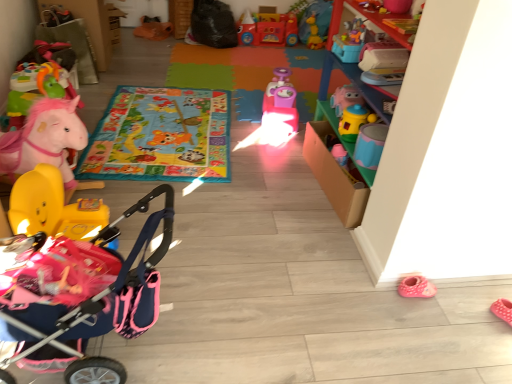
The height and width of the screenshot is (384, 512). In order to click on matte yellow toy at center, the 3th toy in the front-to-back sequence in this screenshot , I will do `click(354, 122)`.

Find the location of a particular element. This screenshot has height=384, width=512. pink plush horse at left, the 5th toy in the front-to-back sequence is located at coordinates [35, 89].

Find the location of `pink fabric baby carriage at lower left`. pink fabric baby carriage at lower left is located at coordinates (82, 291).

What do you see at coordinates (314, 34) in the screenshot?
I see `rubber duck at upper center, arranged as the 9th toy when viewed from the front` at bounding box center [314, 34].

Identify the location of multicolored foam mat at center, which is counted as the 1th mat, starting from the back. The image size is (512, 384). (247, 74).

From the image's perspective, which object appears higher, pink fabric baby carriage at lower left or multicolored foam mat at center, arranged as the 2th mat when viewed from the front?

multicolored foam mat at center, arranged as the 2th mat when viewed from the front, is shown above in the image.

Could you tell me if pink fabric baby carriage at lower left is facing multicolored foam mat at center, arranged as the 2th mat when viewed from the front?

No, pink fabric baby carriage at lower left is not facing towards multicolored foam mat at center, arranged as the 2th mat when viewed from the front.

Is point (135, 316) positioned after point (303, 95)?

No, it is in front of (303, 95).

From a real-world perspective, relative to orange fabric bag at upper center, marked as the 7th toy in a front-to-back arrangement, is pink plush horse at left, which appears as the 5th toy when viewed from the back, vertically above or below?

In terms of real-world spatial position, pink plush horse at left, which appears as the 5th toy when viewed from the back, is above orange fabric bag at upper center, marked as the 7th toy in a front-to-back arrangement.

Is pink plush horse at left, the 5th toy in the front-to-back sequence, not inside orange fabric bag at upper center, marked as the 7th toy in a front-to-back arrangement?

Yes, pink plush horse at left, the 5th toy in the front-to-back sequence, is not within orange fabric bag at upper center, marked as the 7th toy in a front-to-back arrangement.

In the image, is pink plush horse at left, which appears as the 5th toy when viewed from the back, positioned in front of or behind orange fabric bag at upper center, marked as the 7th toy in a front-to-back arrangement?

pink plush horse at left, which appears as the 5th toy when viewed from the back, is positioned closer to the viewer than orange fabric bag at upper center, marked as the 7th toy in a front-to-back arrangement.

How many degrees apart are the facing directions of pink plush horse at left, the 5th toy in the front-to-back sequence, and orange fabric bag at upper center, marked as the 7th toy in a front-to-back arrangement?

The angular difference between pink plush horse at left, the 5th toy in the front-to-back sequence, and orange fabric bag at upper center, marked as the 7th toy in a front-to-back arrangement, is 90 degrees.

From the image's perspective, is multicolored foam mat at center, arranged as the 2th mat when viewed from the front, positioned above or below rubberized plastic toy car at upper center, arranged as the 8th toy when viewed from the front?

Clearly, from the image's perspective, multicolored foam mat at center, arranged as the 2th mat when viewed from the front, is below rubberized plastic toy car at upper center, arranged as the 8th toy when viewed from the front.

Measure the distance between multicolored foam mat at center, which is counted as the 1th mat, starting from the back, and rubberized plastic toy car at upper center, arranged as the 8th toy when viewed from the front.

multicolored foam mat at center, which is counted as the 1th mat, starting from the back, is 23.49 inches from rubberized plastic toy car at upper center, arranged as the 8th toy when viewed from the front.

Considering the relative sizes of multicolored foam mat at center, arranged as the 2th mat when viewed from the front, and rubberized plastic toy car at upper center, arranged as the 8th toy when viewed from the front, in the image provided, is multicolored foam mat at center, arranged as the 2th mat when viewed from the front, taller than rubberized plastic toy car at upper center, arranged as the 8th toy when viewed from the front,?

In fact, multicolored foam mat at center, arranged as the 2th mat when viewed from the front, may be shorter than rubberized plastic toy car at upper center, arranged as the 8th toy when viewed from the front.

Considering the points (221, 74) and (252, 30), which point is in front, point (221, 74) or point (252, 30)?

The point (221, 74) is more forward.

From the image's perspective, would you say multicolored foam mat at center, arranged as the 2th mat when viewed from the front, is shown under pink fabric baby carriage at lower left?

No.

Which is more to the right, multicolored foam mat at center, which is counted as the 1th mat, starting from the back, or pink fabric baby carriage at lower left?

multicolored foam mat at center, which is counted as the 1th mat, starting from the back.

Is multicolored foam mat at center, which is counted as the 1th mat, starting from the back, oriented away from pink fabric baby carriage at lower left?

No.

From a real-world perspective, is multicolored foam mat at center, which is counted as the 1th mat, starting from the back, above or below pink fabric baby carriage at lower left?

multicolored foam mat at center, which is counted as the 1th mat, starting from the back, is below pink fabric baby carriage at lower left.

Is rubberized plastic toy car at upper center, arranged as the 8th toy when viewed from the front, not close to rubber duck at upper center, acting as the first toy starting from the back?

No.

Between rubberized plastic toy car at upper center, arranged as the 8th toy when viewed from the front, and rubber duck at upper center, acting as the first toy starting from the back, which one has more height?

rubberized plastic toy car at upper center, arranged as the 8th toy when viewed from the front.

Considering the sizes of rubberized plastic toy car at upper center, arranged as the 8th toy when viewed from the front, and rubber duck at upper center, acting as the first toy starting from the back, in the image, is rubberized plastic toy car at upper center, arranged as the 8th toy when viewed from the front, bigger or smaller than rubber duck at upper center, acting as the first toy starting from the back,?

rubberized plastic toy car at upper center, arranged as the 8th toy when viewed from the front, is bigger than rubber duck at upper center, acting as the first toy starting from the back.

Is point (282, 23) positioned in front of point (10, 123)?

That is False.

Is pink plush horse at left, which appears as the 5th toy when viewed from the back, at the back of rubberized plastic toy car at upper center, the second toy viewed from the back?

No, rubberized plastic toy car at upper center, the second toy viewed from the back, is not facing the opposite direction of pink plush horse at left, which appears as the 5th toy when viewed from the back.

Which object is thinner, rubberized plastic toy car at upper center, arranged as the 8th toy when viewed from the front, or pink plush horse at left, which appears as the 5th toy when viewed from the back?

rubberized plastic toy car at upper center, arranged as the 8th toy when viewed from the front, is thinner.

In terms of height, does rubberized plastic toy car at upper center, the second toy viewed from the back, look taller or shorter compared to pink plush horse at left, the 5th toy in the front-to-back sequence?

rubberized plastic toy car at upper center, the second toy viewed from the back, is shorter than pink plush horse at left, the 5th toy in the front-to-back sequence.

Is point (346, 92) less distant than point (99, 261)?

That is False.

Is matte plastic toy at upper right, the 6th toy when ordered from back to front, not close to pink fabric baby carriage at lower left?

matte plastic toy at upper right, the 6th toy when ordered from back to front, is positioned a significant distance from pink fabric baby carriage at lower left.

Consider the image. Does matte plastic toy at upper right, the 6th toy when ordered from back to front, turn towards pink fabric baby carriage at lower left?

No, matte plastic toy at upper right, the 6th toy when ordered from back to front, is not oriented towards pink fabric baby carriage at lower left.

The width and height of the screenshot is (512, 384). Identify the location of baby carriage above the multicolored foam mat at center, arranged as the 2th mat when viewed from the front (from a real-world perspective). (82, 291).

Locate an element on the screen. This screenshot has height=384, width=512. toy that is the 3rd object located below the orange fabric bag at upper center, marked as the 7th toy in a front-to-back arrangement (from the image's perspective) is located at coordinates (35, 89).

Consider the image. From the image, which object appears to be nearer to multicolored foam mat at center, which is counted as the 1th mat, starting from the back, vibrant fabric playmat at center, arranged as the 1th mat when viewed from the front, or rubberized plastic toy car at upper center, the second toy viewed from the back?

The object closer to multicolored foam mat at center, which is counted as the 1th mat, starting from the back, is rubberized plastic toy car at upper center, the second toy viewed from the back.

Based on their spatial positions, is pink fabric baby carriage at lower left or matte pink plush horse at left, which is counted as the 8th toy, starting from the back, closer to vibrant fabric playmat at center, arranged as the 1th mat when viewed from the front?

Among the two, matte pink plush horse at left, which is counted as the 8th toy, starting from the back, is located nearer to vibrant fabric playmat at center, arranged as the 1th mat when viewed from the front.

Which object lies nearer to the anchor point matte pink plush horse at left, placed as the 2th toy when sorted from front to back, pink plastic toy car at center, positioned as the fourth toy in back-to-front order, or rubberized plastic toy car at upper center, arranged as the 8th toy when viewed from the front?

pink plastic toy car at center, positioned as the fourth toy in back-to-front order.

Estimate the real-world distances between objects in this image. Which object is closer to pink plush horse at left, the 5th toy in the front-to-back sequence, matte yellow toy at center, the 3th toy in the front-to-back sequence, or matte pink stroller at left, the 9th toy when ordered from back to front?

Based on the image, matte pink stroller at left, the 9th toy when ordered from back to front, appears to be nearer to pink plush horse at left, the 5th toy in the front-to-back sequence.

From the image, which object appears to be farther from matte plastic toy at upper right, which is the fourth toy from front to back, matte yellow toy at center, placed as the 7th toy when sorted from back to front, or matte pink plush horse at left, which is counted as the 8th toy, starting from the back?

Among the two, matte pink plush horse at left, which is counted as the 8th toy, starting from the back, is located further to matte plastic toy at upper right, which is the fourth toy from front to back.

Looking at the image, which one is located closer to matte yellow toy at center, the 3th toy in the front-to-back sequence, rubberized plastic toy car at upper center, the second toy viewed from the back, or orange fabric bag at upper center, marked as the 7th toy in a front-to-back arrangement?

rubberized plastic toy car at upper center, the second toy viewed from the back, lies closer to matte yellow toy at center, the 3th toy in the front-to-back sequence, than the other object.

Estimate the real-world distances between objects in this image. Which object is further from orange fabric bag at upper center, the third toy when ordered from back to front, pink plastic toy car at center, which ranks as the 6th toy in front-to-back order, or rubberized plastic toy car at upper center, the second toy viewed from the back?

pink plastic toy car at center, which ranks as the 6th toy in front-to-back order, lies further to orange fabric bag at upper center, the third toy when ordered from back to front, than the other object.

Looking at this image, estimate the real-world distances between objects in this image. Which object is further from pink fabric baby carriage at lower left, rubber duck at upper center, arranged as the 9th toy when viewed from the front, or pink plush horse at left, which appears as the 5th toy when viewed from the back?

rubber duck at upper center, arranged as the 9th toy when viewed from the front, is further to pink fabric baby carriage at lower left.

Where is `mat positioned between matte pink stroller at left, the 9th toy when ordered from back to front, and pink plush horse at left, which appears as the 5th toy when viewed from the back, from near to far`? mat positioned between matte pink stroller at left, the 9th toy when ordered from back to front, and pink plush horse at left, which appears as the 5th toy when viewed from the back, from near to far is located at coordinates (160, 136).

At what (x,y) coordinates should I click in order to perform the action: click on toy between pink fabric baby carriage at lower left and matte pink plush horse at left, which is counted as the 8th toy, starting from the back, in the front-back direction. Please return your answer as a coordinate pair (x, y). Looking at the image, I should click on (53, 207).

I want to click on mat between pink plush horse at left, the 5th toy in the front-to-back sequence, and rubberized plastic toy car at upper center, arranged as the 8th toy when viewed from the front, along the z-axis, so [x=247, y=74].

Where is `mat positioned between matte pink stroller at left, the 9th toy when ordered from back to front, and pink plastic toy car at center, positioned as the fourth toy in back-to-front order, from near to far`? mat positioned between matte pink stroller at left, the 9th toy when ordered from back to front, and pink plastic toy car at center, positioned as the fourth toy in back-to-front order, from near to far is located at coordinates (x=160, y=136).